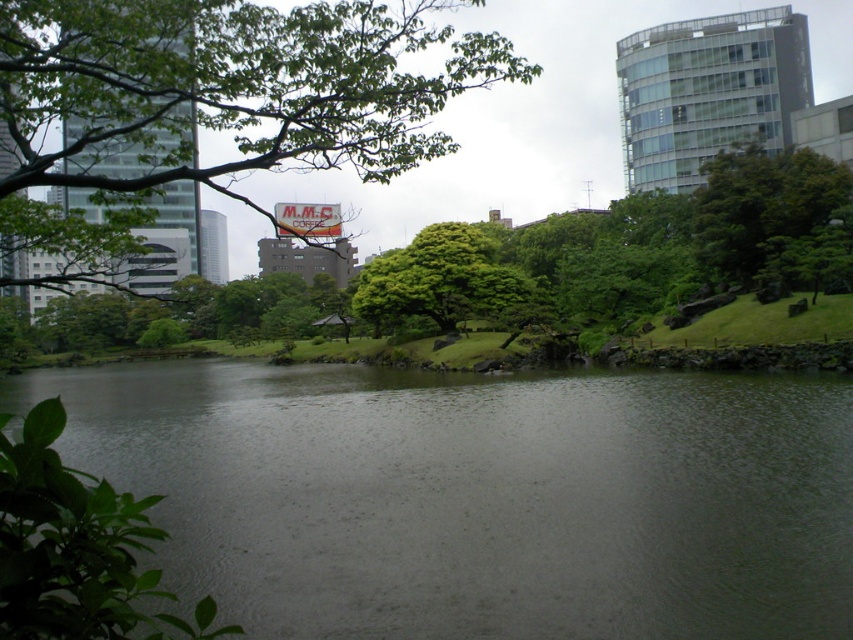
What do you see at coordinates (480, 497) in the screenshot?
I see `green water at center` at bounding box center [480, 497].

Is green water at center bigger than green leafy tree at center?

Indeed, green water at center has a larger size compared to green leafy tree at center.

Where is `green water at center`? The height and width of the screenshot is (640, 853). green water at center is located at coordinates (480, 497).

Can you confirm if green water at center is positioned below green leafy tree at upper center?

Indeed, green water at center is positioned under green leafy tree at upper center.

Can you confirm if green water at center is thinner than green leafy tree at upper center?

Yes, green water at center is thinner than green leafy tree at upper center.

The width and height of the screenshot is (853, 640). What do you see at coordinates (480, 497) in the screenshot?
I see `green water at center` at bounding box center [480, 497].

At what (x,y) coordinates should I click in order to perform the action: click on green water at center. Please return your answer as a coordinate pair (x, y). Looking at the image, I should click on click(x=480, y=497).

Who is higher up, green leafy tree at upper center or green leafy tree at center?

green leafy tree at upper center

Is point (86, 74) positioned in front of point (373, 269)?

Yes, point (86, 74) is in front of point (373, 269).

Where is `green leafy tree at upper center`? The width and height of the screenshot is (853, 640). green leafy tree at upper center is located at coordinates (230, 86).